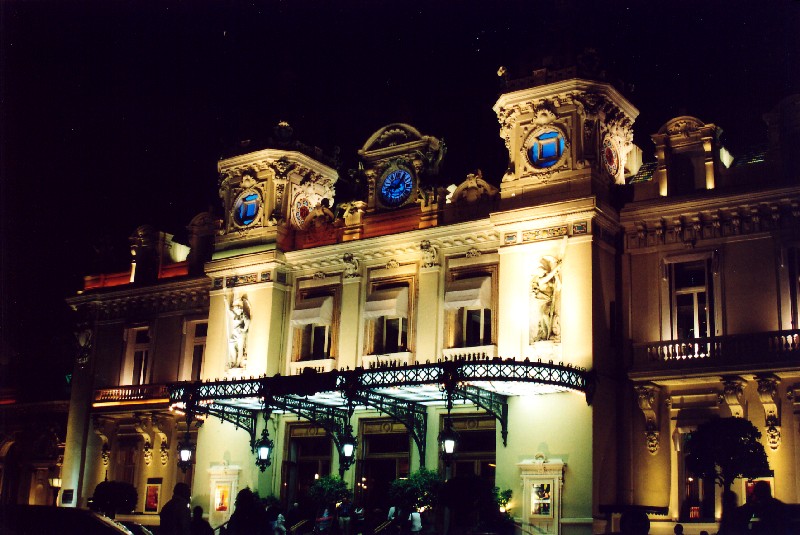
I want to click on statue, so click(x=542, y=290), click(x=237, y=328).